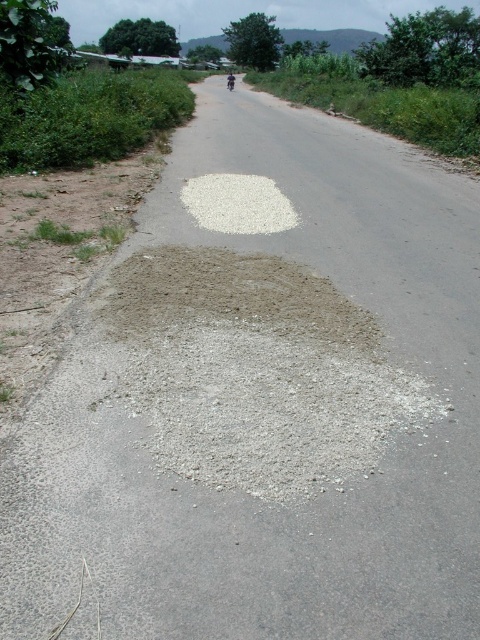
In the scene shown: You are standing on the asphalt road in the rural scene. You notice gray gravel at center. Where exactly is the gray gravel located in relation to your position?

The gray gravel at center is located at the coordinates point (254, 371).

You are a delivery driver who needs to park your metallic silver motorcycle at center near the white gravel at center. Based on the scene description, where should you position the motorcycle relative to the gravel?

The white gravel at center is to the right of the metallic silver motorcycle at center, so you should position the metallic silver motorcycle at center to the left of the white gravel at center.